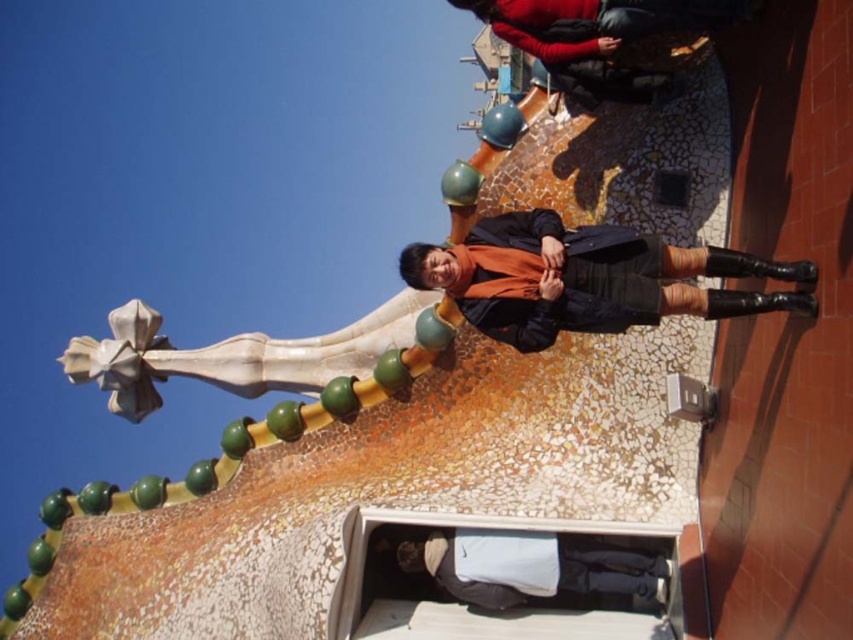
Does matte black coat at center have a lesser height compared to dark gray fabric pants at lower center?

No.

How much distance is there between matte black coat at center and dark gray fabric pants at lower center?

A distance of 17.06 meters exists between matte black coat at center and dark gray fabric pants at lower center.

Is point (442, 285) behind point (549, 552)?

No, (442, 285) is in front of (549, 552).

Where is `matte black coat at center`? matte black coat at center is located at coordinates 589,278.